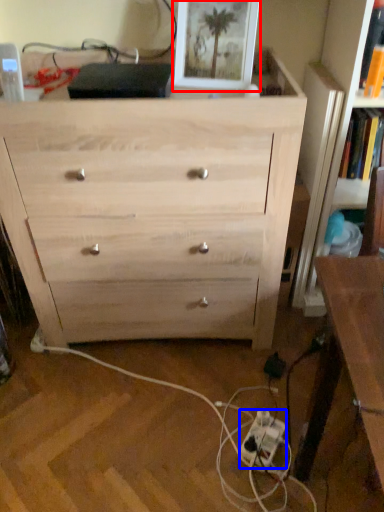
Question: Among these objects, which one is nearest to the camera, picture frame (highlighted by a red box) or extension cord (highlighted by a blue box)?

Choices:
 (A) picture frame
 (B) extension cord

Answer: (A)